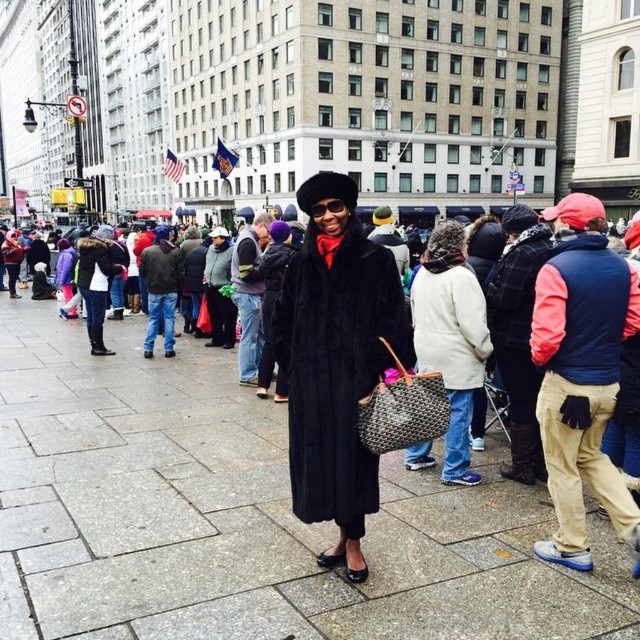
Based on the photo, does smooth concrete pavement at center lie behind white wool coat at center?

No, smooth concrete pavement at center is closer to the viewer.

Describe the element at coordinates (244, 516) in the screenshot. I see `smooth concrete pavement at center` at that location.

Image resolution: width=640 pixels, height=640 pixels. I want to click on smooth concrete pavement at center, so click(x=244, y=516).

Can you confirm if velvet black coat at center is thinner than white wool coat at center?

No.

Who is more forward, (308, 253) or (458, 442)?

Point (308, 253) is more forward.

Measure the distance between velvet black coat at center and camera.

A distance of 17.47 meters exists between velvet black coat at center and camera.

What are the coordinates of `velvet black coat at center` in the screenshot? It's located at pyautogui.click(x=336, y=360).

Image resolution: width=640 pixels, height=640 pixels. In order to click on smooth concrete pavement at center in this screenshot , I will do `click(244, 516)`.

Is smooth concrete pavement at center smaller than velvet black coat at center?

No, smooth concrete pavement at center is not smaller than velvet black coat at center.

Is point (198, 392) behind point (390, 323)?

Yes, point (198, 392) is behind point (390, 323).

Locate an element on the screen. smooth concrete pavement at center is located at coordinates (244, 516).